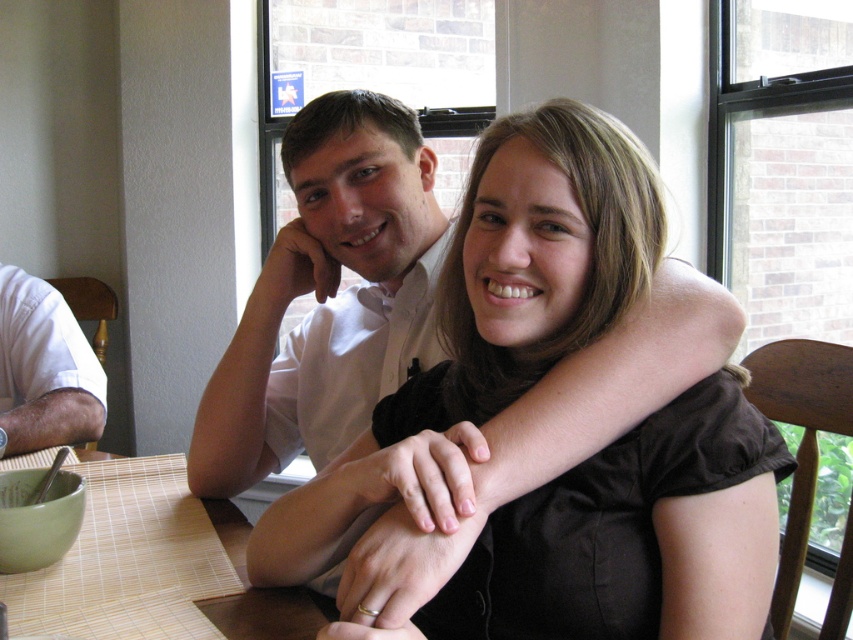
Question: Is black satin blouse at upper center above white cotton shirt at left?

Choices:
 (A) no
 (B) yes

Answer: (B)

Question: Among these objects, which one is farthest from the camera?

Choices:
 (A) white cotton shirt at left
 (B) black satin blouse at upper center

Answer: (A)

Question: Among these objects, which one is nearest to the camera?

Choices:
 (A) white cotton shirt at left
 (B) bamboo placemat at lower left
 (C) black satin blouse at upper center

Answer: (C)

Question: Is black satin blouse at upper center wider than bamboo placemat at lower left?

Choices:
 (A) yes
 (B) no

Answer: (B)

Question: Among these objects, which one is nearest to the camera?

Choices:
 (A) bamboo placemat at lower left
 (B) black satin blouse at upper center

Answer: (B)

Question: Observing the image, what is the correct spatial positioning of black satin blouse at upper center in reference to bamboo placemat at lower left?

Choices:
 (A) above
 (B) below

Answer: (A)